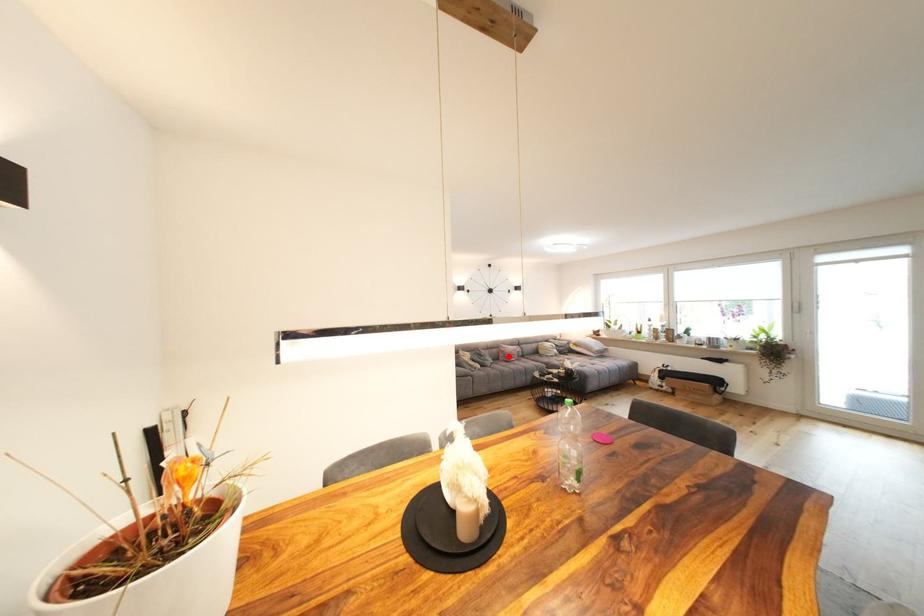
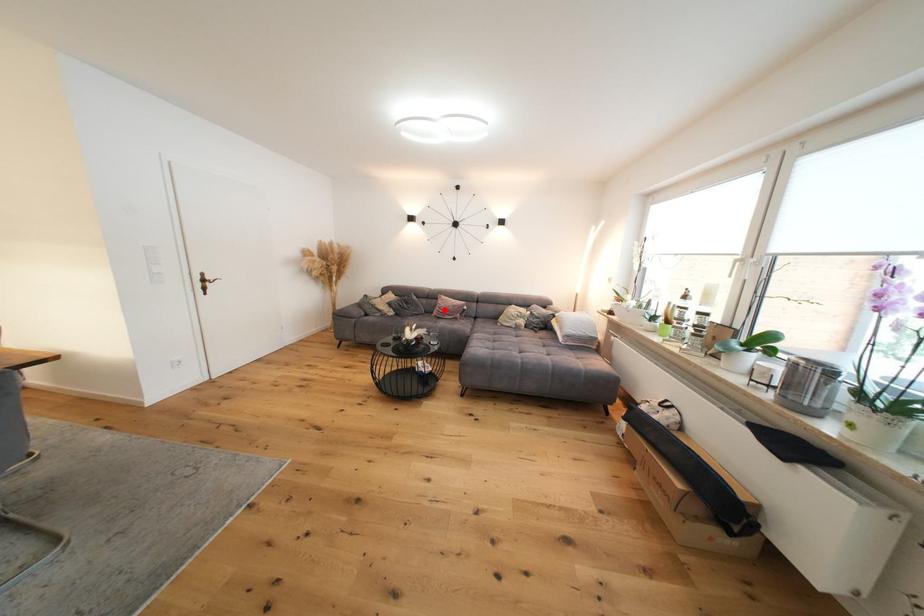
I am providing you with two images of the same scene from different viewpoints. A red point is marked on the first image and another point is marked on the second image. Is the marked point in image1 the same physical position as the marked point in image2?

Yes